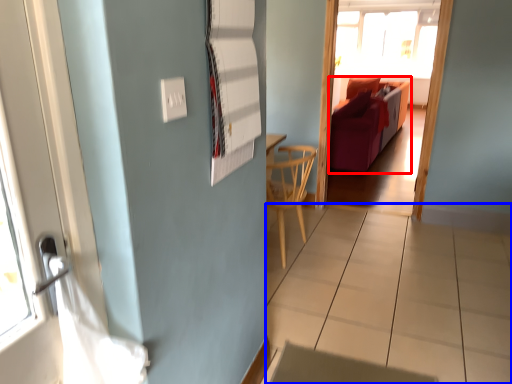
Question: Among these objects, which one is farthest to the camera, furniture (highlighted by a red box) or tile (highlighted by a blue box)?

Choices:
 (A) furniture
 (B) tile

Answer: (A)